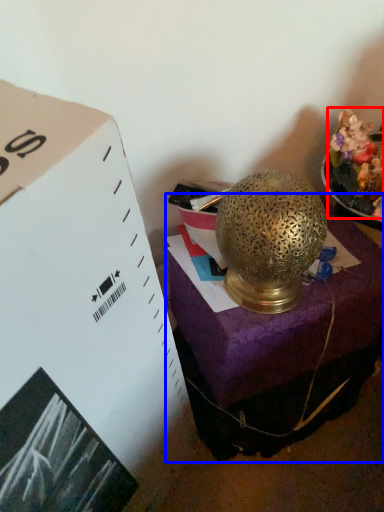
Question: Which object is closer to the camera taking this photo, food (highlighted by a red box) or furniture (highlighted by a blue box)?

Choices:
 (A) food
 (B) furniture

Answer: (A)